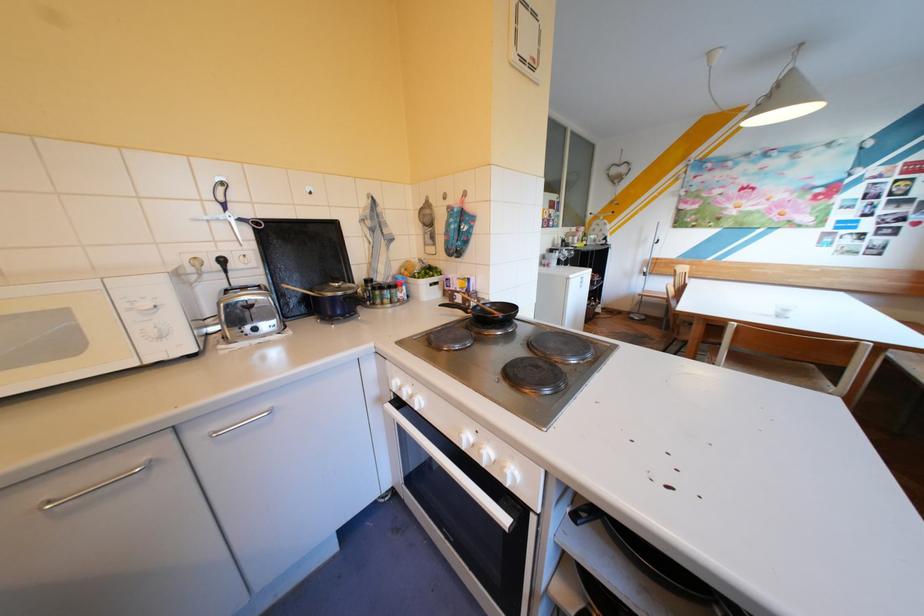
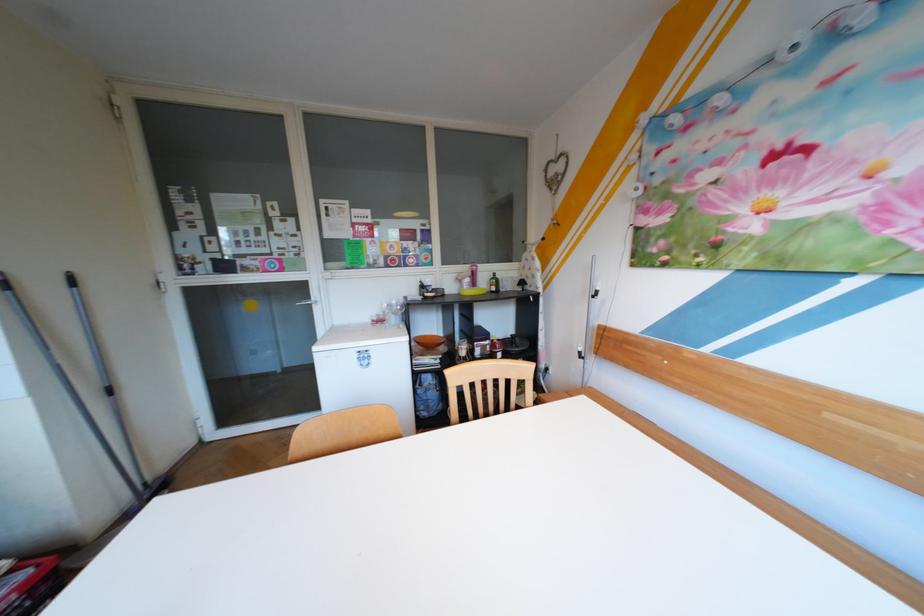
The images are taken continuously from a first-person perspective. In which direction are you moving?

The movement direction of the cameraman is right, forward.